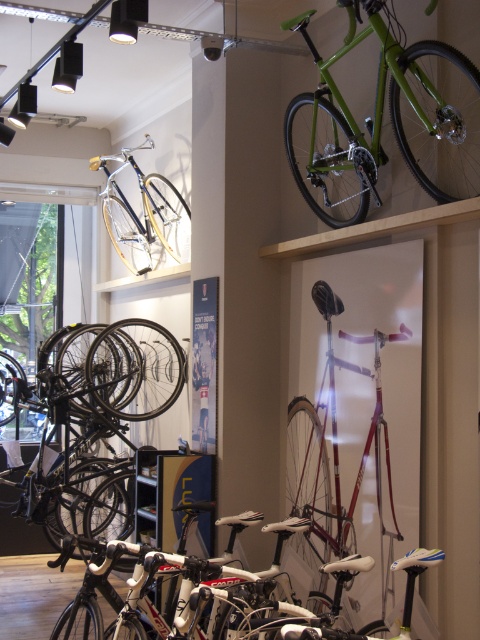
Which of these two, green matte bicycle at upper right or shiny silver bicycle at upper center, stands taller?

Standing taller between the two is shiny silver bicycle at upper center.

At what (x,y) coordinates should I click in order to perform the action: click on green matte bicycle at upper right. Please return your answer as a coordinate pair (x, y). Looking at the image, I should click on (381, 124).

Find the location of `green matte bicycle at upper right`. green matte bicycle at upper right is located at coordinates (381, 124).

Is shiny black bike at lower left bigger than shiny purple bicycle at center?

Yes, shiny black bike at lower left is bigger than shiny purple bicycle at center.

What do you see at coordinates (90, 419) in the screenshot?
I see `shiny black bike at lower left` at bounding box center [90, 419].

Where is `shiny black bike at lower left`? The width and height of the screenshot is (480, 640). shiny black bike at lower left is located at coordinates (90, 419).

Is point (123, 531) more distant than point (109, 179)?

No, it is in front of (109, 179).

Is shiny black bike at lower left bigger than shiny silver bicycle at upper center?

Yes, shiny black bike at lower left is bigger than shiny silver bicycle at upper center.

Describe the element at coordinates (90, 419) in the screenshot. The image size is (480, 640). I see `shiny black bike at lower left` at that location.

Identify the location of shiny black bike at lower left. This screenshot has height=640, width=480. (90, 419).